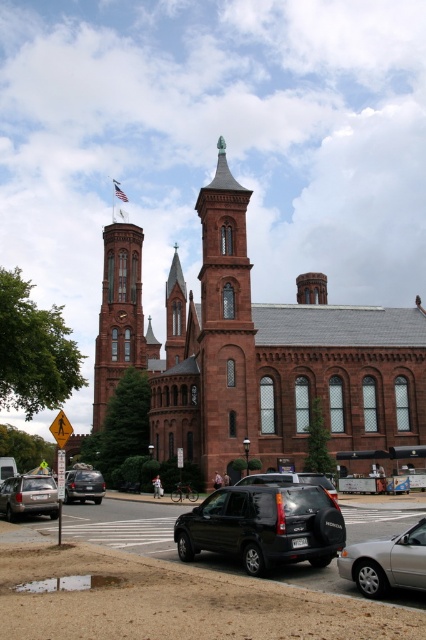
Question: Does black matte suv at lower center appear on the left side of silver metallic sedan at lower right?

Choices:
 (A) no
 (B) yes

Answer: (B)

Question: Which object is the closest to the silver metallic sedan at lower right?

Choices:
 (A) red brick church at center
 (B) satin black suv at center
 (C) smooth brick tower at center

Answer: (B)

Question: Estimate the real-world distances between objects in this image. Which object is farther from the matte silver suv at lower left?

Choices:
 (A) matte black suv at lower left
 (B) smooth brick tower at center

Answer: (B)

Question: Which point is closer to the camera taking this photo?

Choices:
 (A) (213, 464)
 (B) (100, 500)
 (C) (210, 545)
 (D) (57, 442)

Answer: (C)

Question: Is black matte suv at lower center above silver metallic sedan at lower right?

Choices:
 (A) no
 (B) yes

Answer: (A)

Question: Is black matte suv at lower center smaller than matte black suv at lower left?

Choices:
 (A) yes
 (B) no

Answer: (A)